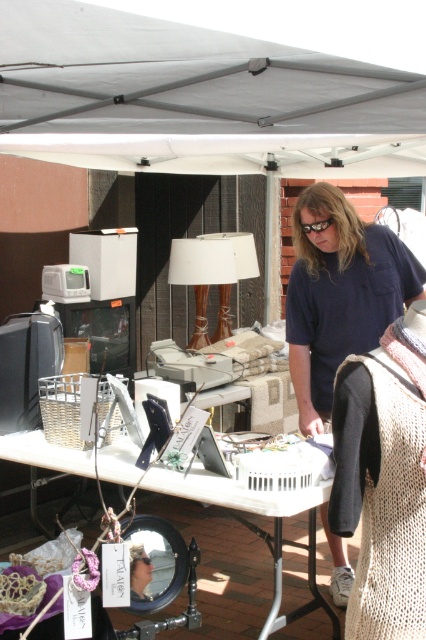
Question: Is gray fabric canopy at upper center closer to camera compared to metallic silver mirror at center?

Choices:
 (A) no
 (B) yes

Answer: (B)

Question: Observing the image, what is the correct spatial positioning of dark blue shirt at center in reference to metallic silver mirror at center?

Choices:
 (A) above
 (B) below

Answer: (A)

Question: Among these objects, which one is nearest to the camera?

Choices:
 (A) dark blue shirt at center
 (B) metallic silver mirror at center
 (C) gray fabric canopy at upper center

Answer: (C)

Question: Among these points, which one is farthest from the camera?

Choices:
 (A) (247, 90)
 (B) (290, 616)

Answer: (B)

Question: Is dark blue shirt at center bigger than metallic silver mirror at center?

Choices:
 (A) no
 (B) yes

Answer: (A)

Question: Which object is closer to the camera taking this photo?

Choices:
 (A) dark blue shirt at center
 (B) metallic silver mirror at center

Answer: (B)